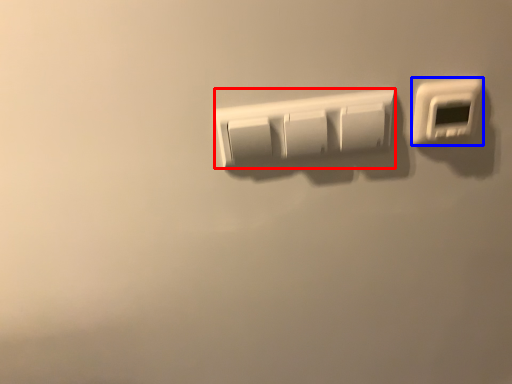
Question: Which of the following is the closest to the observer, light switch (highlighted by a red box) or light switch (highlighted by a blue box)?

Choices:
 (A) light switch
 (B) light switch

Answer: (B)